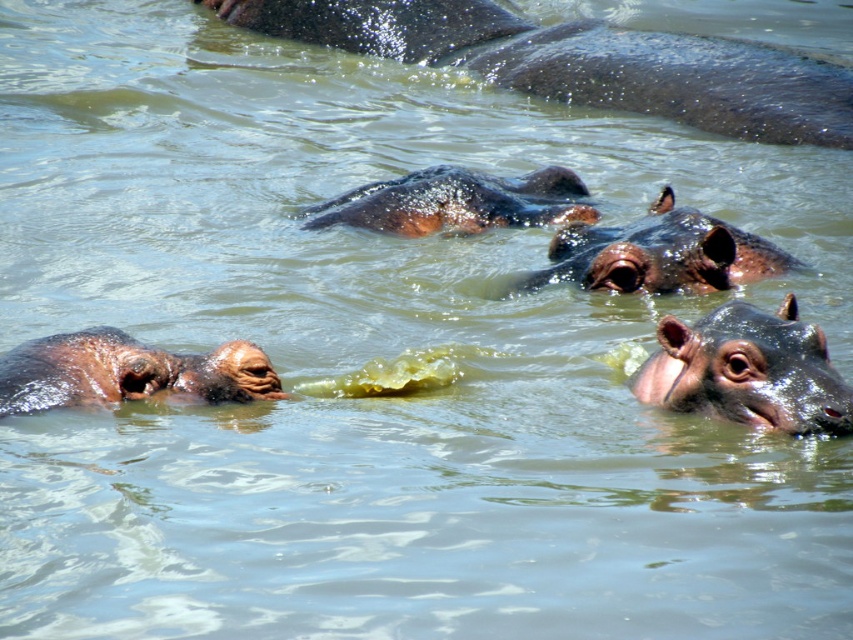
Based on the photo, who is more forward, (x=764, y=58) or (x=492, y=180)?

Point (x=492, y=180)

Is dark brown textured hippo at upper center shorter than brown matte hippo at center?

No, dark brown textured hippo at upper center is not shorter than brown matte hippo at center.

Who is more forward, [816,93] or [527,211]?

Positioned in front is point [527,211].

At what (x,y) coordinates should I click in order to perform the action: click on dark brown textured hippo at upper center. Please return your answer as a coordinate pair (x, y). Looking at the image, I should click on (583, 61).

Can you confirm if dark brown textured hippo at upper center is bigger than shiny brown hippo at center?

Correct, dark brown textured hippo at upper center is larger in size than shiny brown hippo at center.

Measure the distance between dark brown textured hippo at upper center and shiny brown hippo at center.

The distance of dark brown textured hippo at upper center from shiny brown hippo at center is 2.77 meters.

This screenshot has width=853, height=640. What do you see at coordinates (583, 61) in the screenshot?
I see `dark brown textured hippo at upper center` at bounding box center [583, 61].

At what (x,y) coordinates should I click in order to perform the action: click on dark brown textured hippo at upper center. Please return your answer as a coordinate pair (x, y). Looking at the image, I should click on click(583, 61).

Who is taller, shiny brown hippo at right or shiny brown hippo at center?

Standing taller between the two is shiny brown hippo at center.

Is shiny brown hippo at right shorter than shiny brown hippo at center?

Yes, shiny brown hippo at right is shorter than shiny brown hippo at center.

Locate an element on the screen. The image size is (853, 640). shiny brown hippo at right is located at coordinates (747, 371).

The image size is (853, 640). What are the coordinates of `shiny brown hippo at right` in the screenshot? It's located at (747, 371).